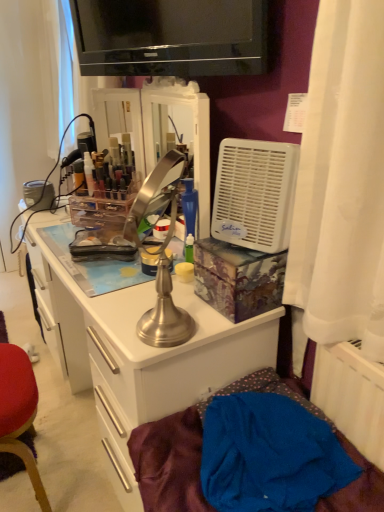
Question: In the image, is brushed metal desk at center on the left side or the right side of brushed metal table lamp at center?

Choices:
 (A) right
 (B) left

Answer: (B)

Question: In terms of size, does brushed metal desk at center appear bigger or smaller than brushed metal table lamp at center?

Choices:
 (A) small
 (B) big

Answer: (B)

Question: Which is farther from the blue fabric at lower right?

Choices:
 (A) brushed metal table lamp at center
 (B) black glossy television at upper center
 (C) white plastic air conditioner at right
 (D) brushed metal desk at center

Answer: (B)

Question: Estimate the real-world distances between objects in this image. Which object is farther from the brushed metal table lamp at center?

Choices:
 (A) brushed metal desk at center
 (B) black glossy television at upper center
 (C) white plastic air conditioner at right
 (D) blue fabric at lower right

Answer: (B)